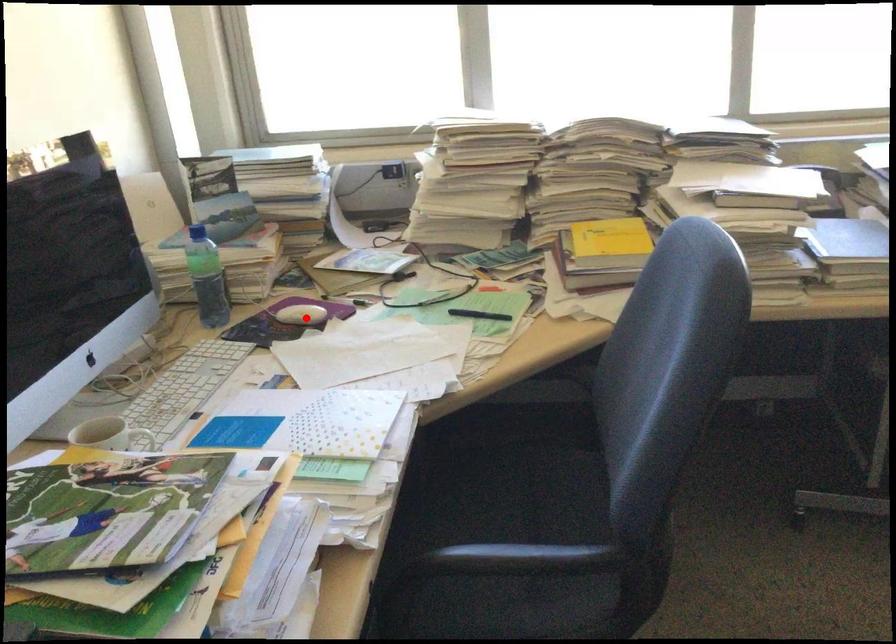
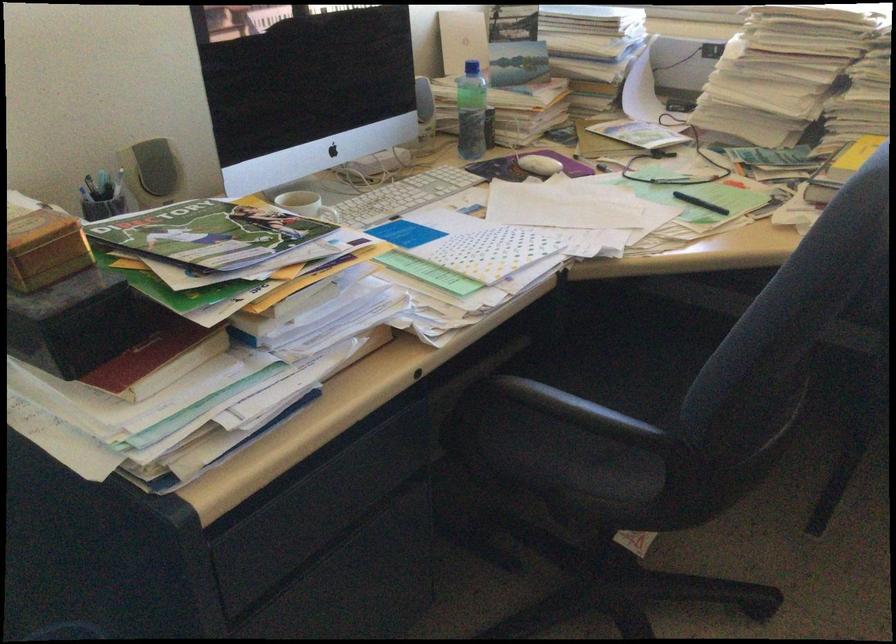
In the second image, find the point that corresponds to the highlighted location in the first image.

(538, 165)